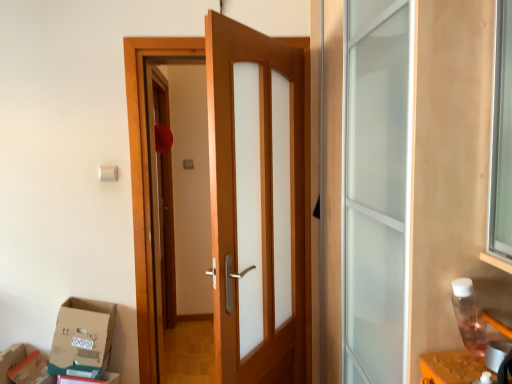
Question: Is wooden door at center outside of cardboard box at lower left, which is the 2th cardboard box from left to right?

Choices:
 (A) yes
 (B) no

Answer: (A)

Question: Can you confirm if wooden door at center is wider than cardboard box at lower left, which is the 2th cardboard box from left to right?

Choices:
 (A) yes
 (B) no

Answer: (B)

Question: Can you confirm if wooden door at center is thinner than cardboard box at lower left, which is the 2th cardboard box from left to right?

Choices:
 (A) yes
 (B) no

Answer: (A)

Question: Is wooden door at center at the left side of cardboard box at lower left, the 1th cardboard box positioned from the right?

Choices:
 (A) yes
 (B) no

Answer: (B)

Question: From the image's perspective, is wooden door at center below cardboard box at lower left, which is the 2th cardboard box from left to right?

Choices:
 (A) no
 (B) yes

Answer: (A)

Question: Is teal cardboard box at lower left, which appears as the 1th cardboard box when viewed from the left, bigger or smaller than cardboard box at lower left?

Choices:
 (A) small
 (B) big

Answer: (A)

Question: Considering the relative positions of teal cardboard box at lower left, which appears as the 1th cardboard box when viewed from the left, and cardboard box at lower left in the image provided, is teal cardboard box at lower left, which appears as the 1th cardboard box when viewed from the left, to the left or to the right of cardboard box at lower left?

Choices:
 (A) left
 (B) right

Answer: (B)

Question: Is point (24, 349) closer or farther from the camera than point (15, 344)?

Choices:
 (A) closer
 (B) farther

Answer: (A)

Question: Looking at their shapes, would you say teal cardboard box at lower left, which ranks as the 2th cardboard box in right-to-left order, is wider or thinner than cardboard box at lower left?

Choices:
 (A) wide
 (B) thin

Answer: (B)

Question: Is cardboard box at lower left to the left or to the right of cardboard box at lower left, which is the 2th cardboard box from left to right, in the image?

Choices:
 (A) left
 (B) right

Answer: (A)

Question: Is point (8, 349) positioned closer to the camera than point (99, 350)?

Choices:
 (A) closer
 (B) farther

Answer: (B)

Question: In the image, is cardboard box at lower left positioned in front of or behind cardboard box at lower left, the 1th cardboard box positioned from the right?

Choices:
 (A) behind
 (B) front

Answer: (B)

Question: Would you say cardboard box at lower left is inside or outside cardboard box at lower left, which is the 2th cardboard box from left to right?

Choices:
 (A) outside
 (B) inside

Answer: (A)

Question: From the image's perspective, is wooden door at center located above or below teal cardboard box at lower left, which appears as the 1th cardboard box when viewed from the left?

Choices:
 (A) above
 (B) below

Answer: (A)

Question: Looking at their shapes, would you say wooden door at center is wider or thinner than teal cardboard box at lower left, which ranks as the 2th cardboard box in right-to-left order?

Choices:
 (A) thin
 (B) wide

Answer: (B)